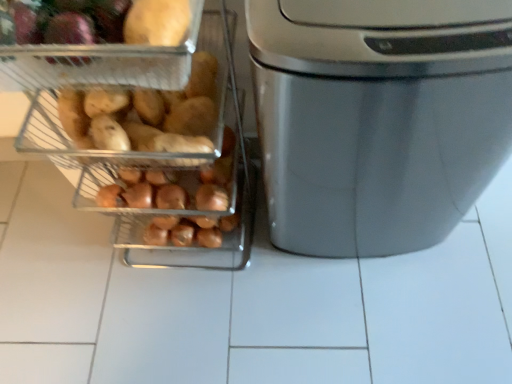
Where is `free space in front of satin silver trash can at right`? Image resolution: width=512 pixels, height=384 pixels. free space in front of satin silver trash can at right is located at coordinates (379, 317).